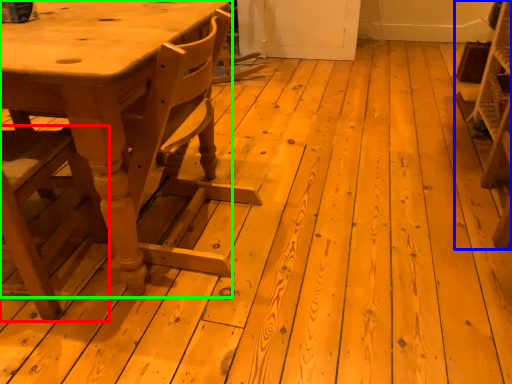
Question: Considering the real-world distances, which object is farthest from chair (highlighted by a red box)? shelf (highlighted by a blue box) or table (highlighted by a green box)?

Choices:
 (A) shelf
 (B) table

Answer: (A)